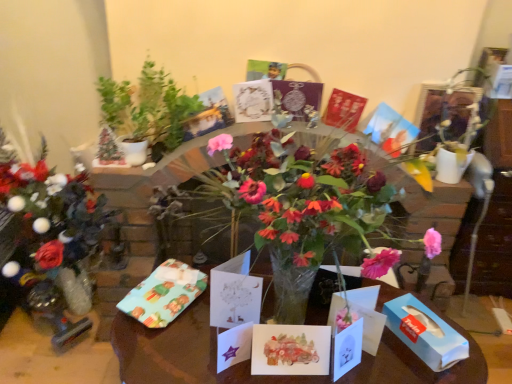
Locate an element on the screen. The width and height of the screenshot is (512, 384). free spot in front of blue paper tissue box at lower right is located at coordinates (419, 370).